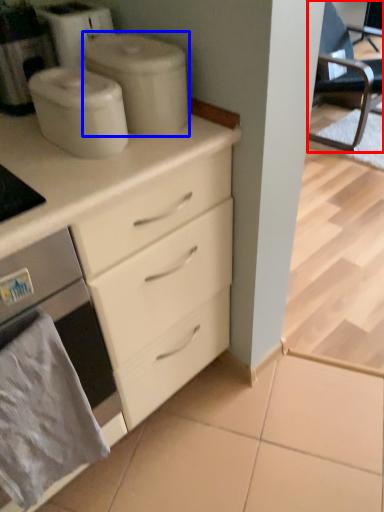
Question: Which of the following is the closest to the observer, chair (highlighted by a red box) or appliance (highlighted by a blue box)?

Choices:
 (A) chair
 (B) appliance

Answer: (B)